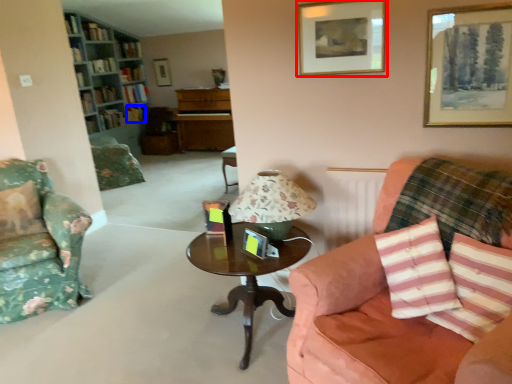
Question: Among these objects, which one is farthest to the camera, picture frame (highlighted by a red box) or book (highlighted by a blue box)?

Choices:
 (A) picture frame
 (B) book

Answer: (B)